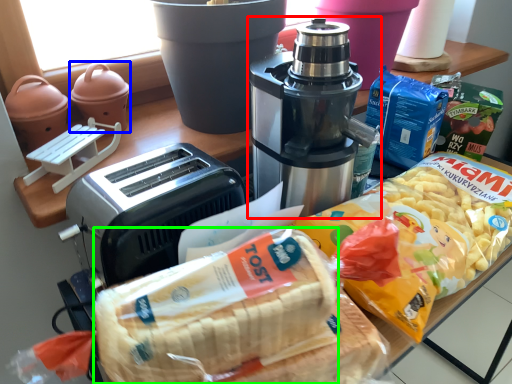
Question: Considering the real-world distances, which object is closest to coffee maker (highlighted by a red box)? appliance (highlighted by a blue box) or treat (highlighted by a green box).

Choices:
 (A) appliance
 (B) treat

Answer: (B)